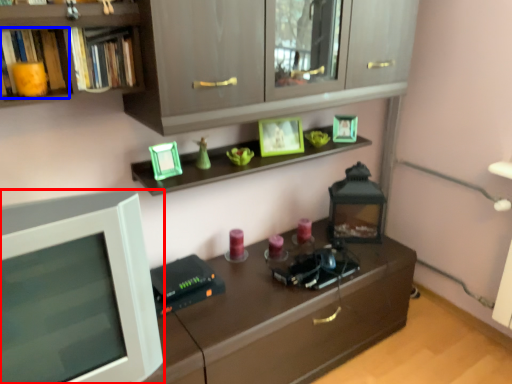
Question: Which of the following is the farthest to the observer, computer monitor (highlighted by a red box) or book (highlighted by a blue box)?

Choices:
 (A) computer monitor
 (B) book

Answer: (B)